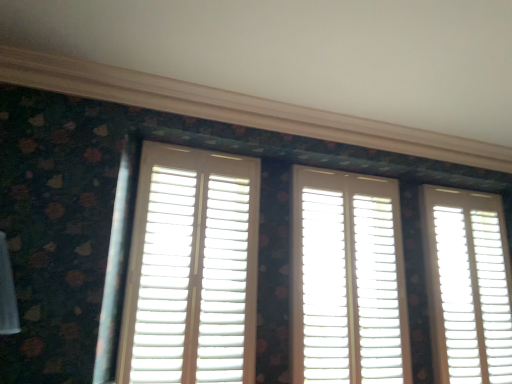
Question: Is white wood shutters at center, the 2th window in the left-to-right sequence, inside the boundaries of white matte shutters at center, marked as the first window in a left-to-right arrangement, or outside?

Choices:
 (A) outside
 (B) inside

Answer: (A)

Question: Is white wood shutters at center, marked as the 2th window in a right-to-left arrangement, wider or thinner than white matte shutters at center, marked as the first window in a left-to-right arrangement?

Choices:
 (A) wide
 (B) thin

Answer: (A)

Question: Estimate the real-world distances between objects in this image. Which object is farther from the white matte shutters at center, which is the third window in right-to-left order?

Choices:
 (A) white wood shutters at center, marked as the 2th window in a right-to-left arrangement
 (B) white matte shutter at right, the first window positioned from the right

Answer: (B)

Question: Based on their relative distances, which object is nearer to the white matte shutters at center, which is the third window in right-to-left order?

Choices:
 (A) white wood shutters at center, the 2th window in the left-to-right sequence
 (B) white matte shutter at right, acting as the 3th window starting from the left

Answer: (A)